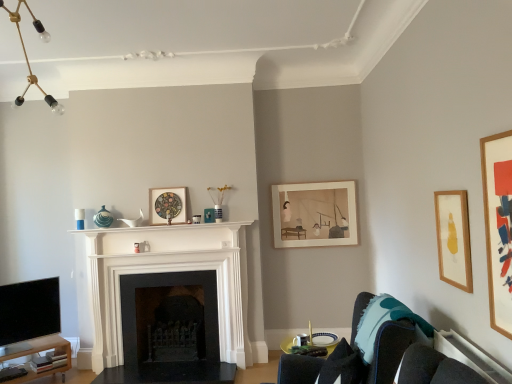
Locate an element on the screen. vacant point above matte paper picture frame at center-right, the 3th picture frame when ordered from right to left (from a real-world perspective) is located at coordinates (308, 183).